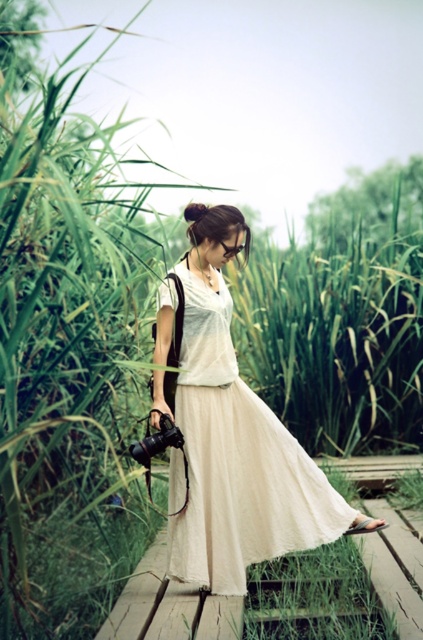
You are a photographer trying to capture the woman in the scene. You notice the light beige cotton dress at center and the black matte camera at lower left. Which object is positioned to the right of the other?

The light beige cotton dress at center is to the right of the black matte camera at lower left.